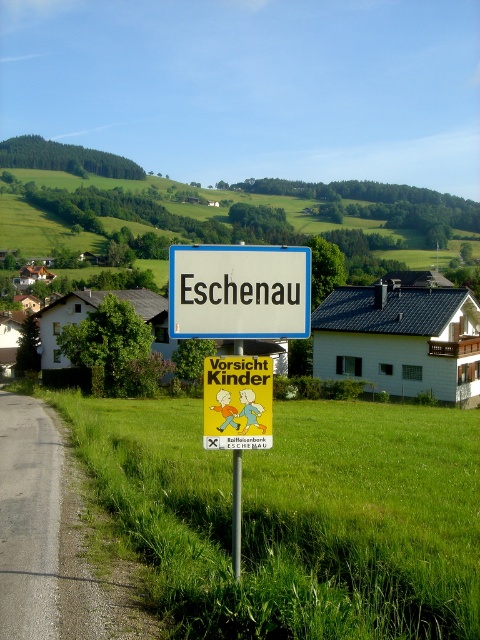
Can you confirm if green grass at lower center is smaller than yellow paper sign at center?

Incorrect, green grass at lower center is not smaller in size than yellow paper sign at center.

Between green grass at lower center and yellow paper sign at center, which one appears on the right side from the viewer's perspective?

green grass at lower center

Locate an element on the screen. This screenshot has width=480, height=640. green grass at lower center is located at coordinates (295, 516).

Is the position of white plastic sign at center less distant than that of yellow paper sign at center?

No.

Who is more distant from viewer, (216,326) or (211,381)?

The point (216,326) is more distant.

Identify the location of white plastic sign at center. This screenshot has width=480, height=640. (239, 291).

Can you confirm if green grass at lower center is wider than metallic pole at center?

Indeed, green grass at lower center has a greater width compared to metallic pole at center.

Is green grass at lower center to the left of metallic pole at center from the viewer's perspective?

No, green grass at lower center is not to the left of metallic pole at center.

Is point (459, 568) positioned in front of point (233, 497)?

That is False.

Where is `green grass at lower center`? green grass at lower center is located at coordinates [295, 516].